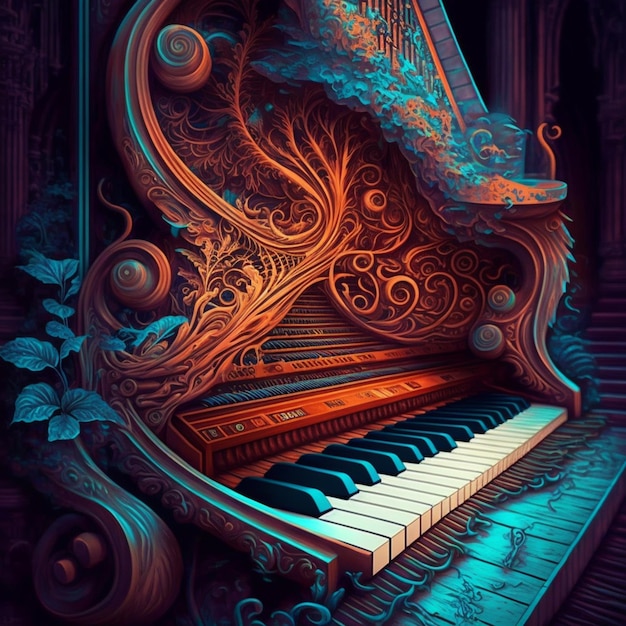
Image resolution: width=626 pixels, height=626 pixels. Find the location of `centre of tree-like carving on the piano`. centre of tree-like carving on the piano is located at coordinates (324, 252).